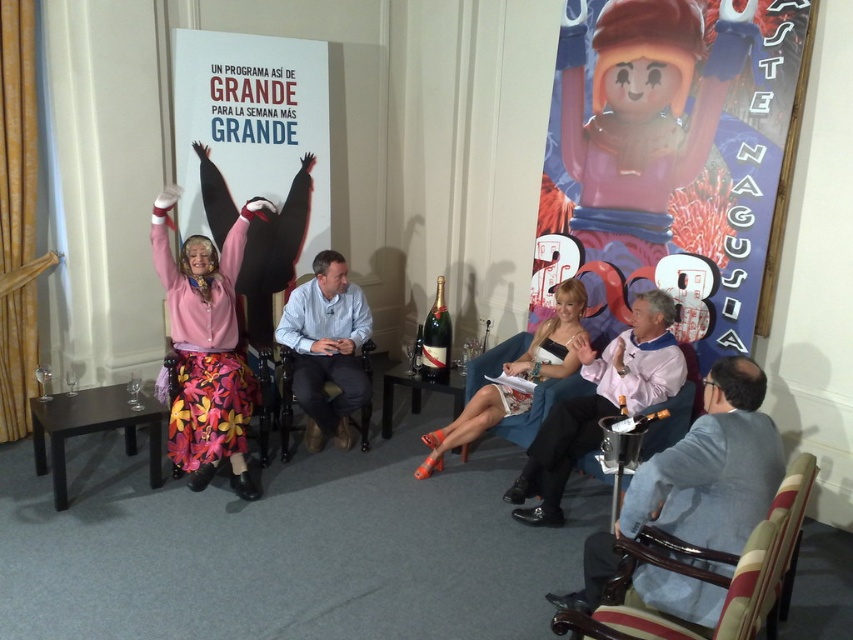
You are organizing a photo shoot and need to arrange the matte pink fabric at upper left and the pink fabric shirt at center in a way that maintains their original spatial relationship. Which object should be placed to the left of the other?

The matte pink fabric at upper left should be placed to the left of the pink fabric shirt at center to maintain their original spatial relationship.

You are an event organizer who needs to adjust seating arrangements. The light blue shirt at center and the floral fabric armchair at center are both at the center. Which one is taller?

The light blue shirt at center is much taller than the floral fabric armchair at center.